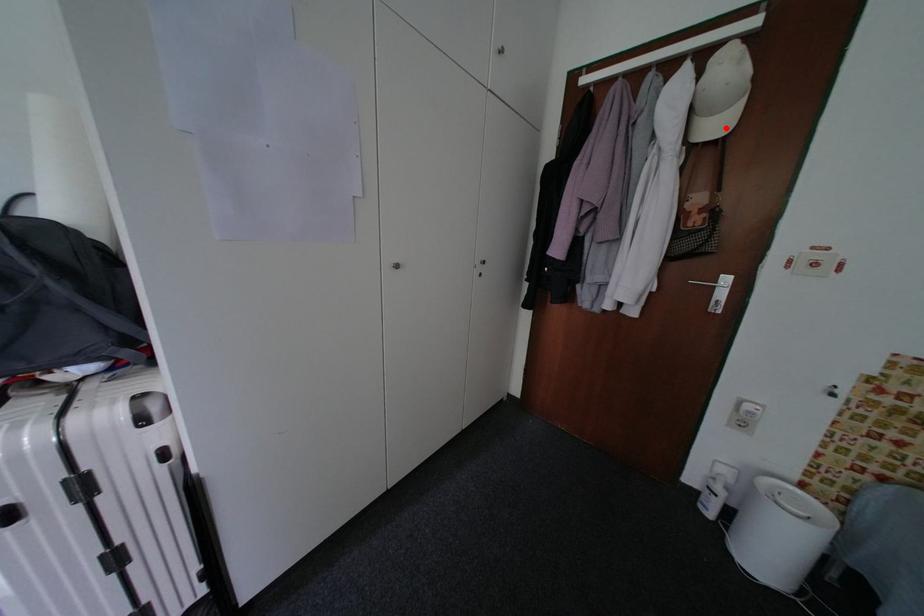
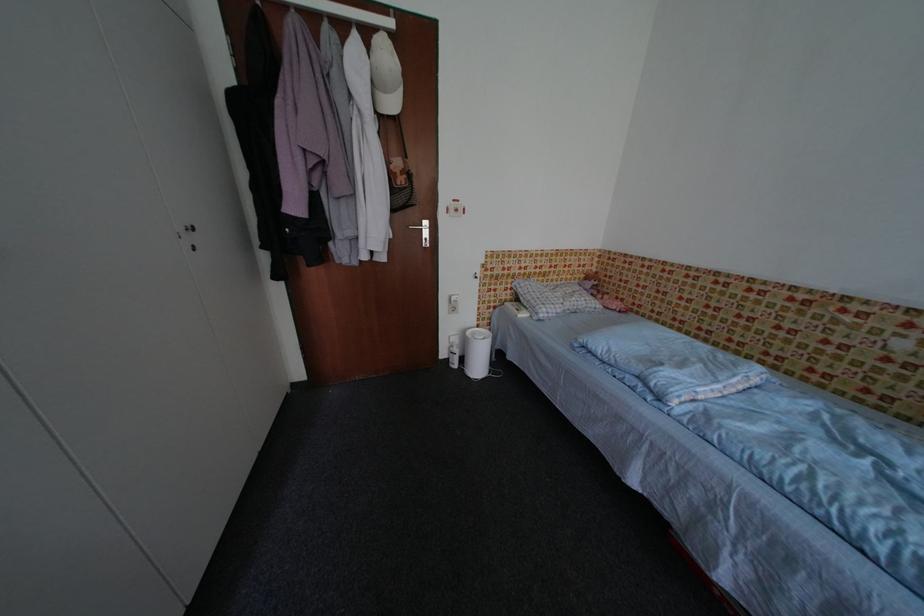
Where in the second image is the point corresponding to the highlighted location from the first image?

(400, 107)